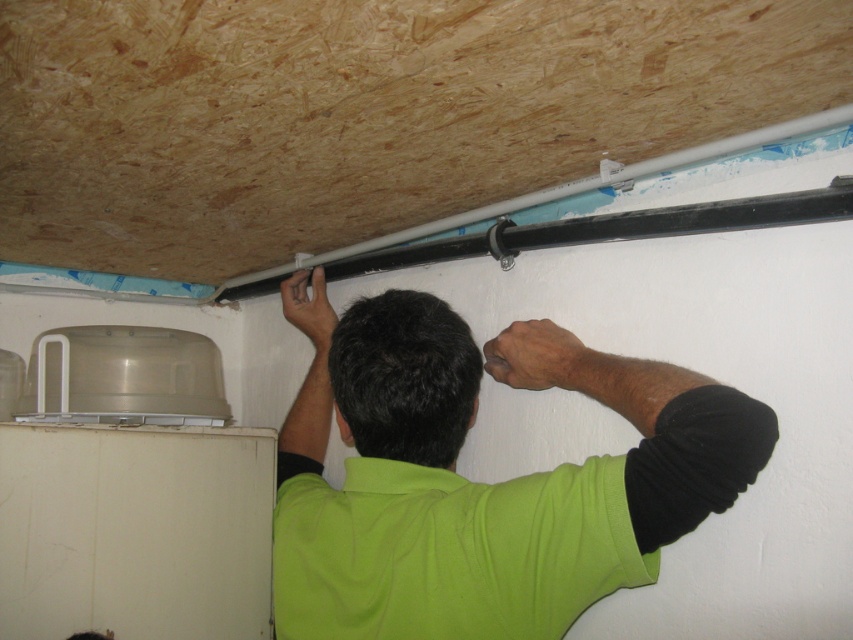
You are a maintenance worker needing to reach the white plastic exhaust hood at upper center and the green matte shirt at center. Which object is closer to you?

The white plastic exhaust hood at upper center is closer to you than the green matte shirt at center.